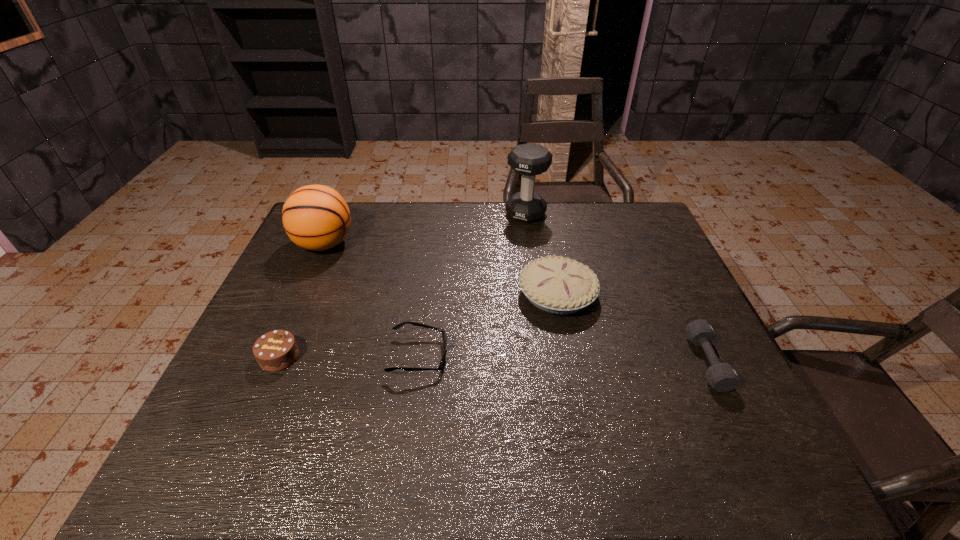
Where is `free point between the fifth shortest object and the farthest object`? free point between the fifth shortest object and the farthest object is located at coordinates (425, 229).

Where is `free space that is in between the fourth nearest object and the shortest object`? This screenshot has height=540, width=960. free space that is in between the fourth nearest object and the shortest object is located at coordinates (488, 325).

I want to click on free area in between the chocolate cake and the sunglasses, so click(349, 356).

This screenshot has height=540, width=960. Identify the location of free area in between the chocolate cake and the tallest object. (402, 285).

I want to click on vacant area that lies between the sunglasses and the taller dumbbell, so click(472, 285).

Select which object appears as the fourth closest to the farthest object. Please provide its 2D coordinates. Your answer should be formatted as a tuple, i.e. [(x, y)], where the tuple contains the x and y coordinates of a point satisfying the conditions above.

[(722, 377)]

Locate an element on the screen. The height and width of the screenshot is (540, 960). the fifth closest object to the chocolate cake is located at coordinates (722, 377).

Where is `free location that satisfies the following two spatial constraints: 1. on the front side of the left dumbbell; 2. on the right side of the nearer dumbbell`? The image size is (960, 540). free location that satisfies the following two spatial constraints: 1. on the front side of the left dumbbell; 2. on the right side of the nearer dumbbell is located at coordinates (547, 362).

At what (x,y) coordinates should I click in order to perform the action: click on vacant space that satisfies the following two spatial constraints: 1. on the back side of the second farthest object; 2. on the right side of the left dumbbell. Please return your answer as a coordinate pair (x, y). Looking at the image, I should click on (338, 214).